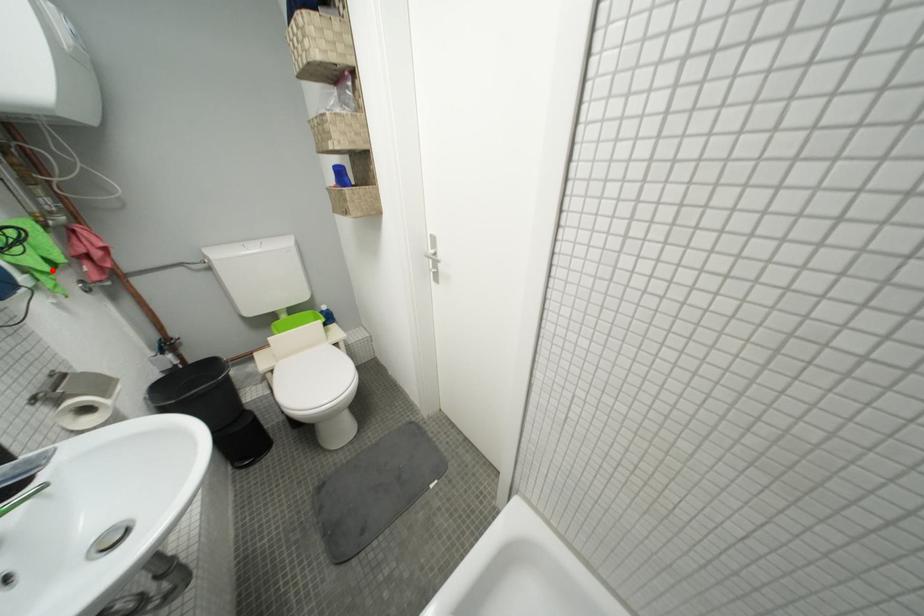
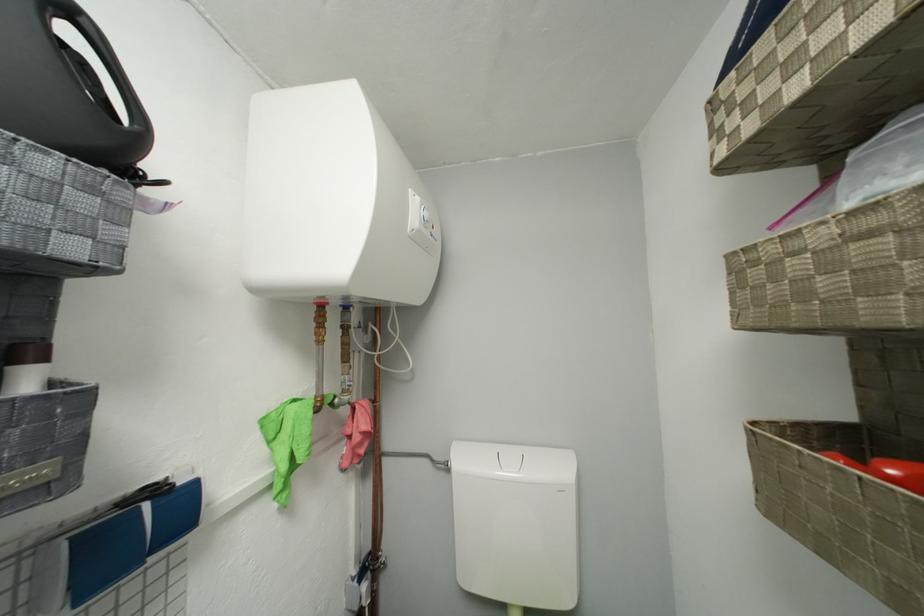
The point at the highlighted location is marked in the first image. Where is the corresponding point in the second image?

(293, 469)